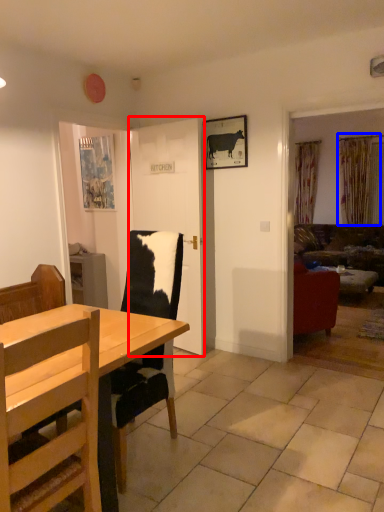
Question: Which point is closer to the camera, door (highlighted by a red box) or curtain (highlighted by a blue box)?

Choices:
 (A) door
 (B) curtain

Answer: (A)